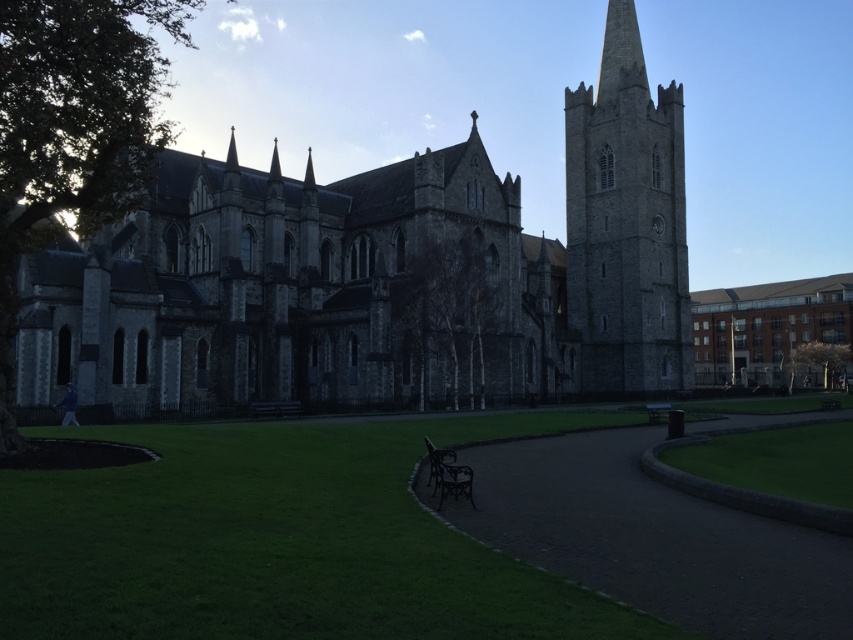
You are a tourist standing at the entrance of the cathedral and want to sit on the dark brown wooden bench at center. Which direction should you walk to reach it from the dark stone path at center?

The dark stone path at center is in front of the dark brown wooden bench at center, so you should walk forward along the dark stone path at center to reach the bench.

You are standing in the grassy area in front of the gray stone tower at center. You want to take a photo of the tower with your smartphone. The camera says you are 100 meters away from the subject. Should you move closer or farther away to get the best shot?

The gray stone tower at center is actually 105.33 meters away from you. Since the camera indicates 100 meters, you should move slightly closer to align with the actual distance for the best shot.

You are a tourist standing at the entrance of the cathedral and want to sit down to rest. You see the dark stone path at center and the dark brown wooden bench at center. Which object is higher in elevation?

The dark stone path at center is higher than the dark brown wooden bench at center.